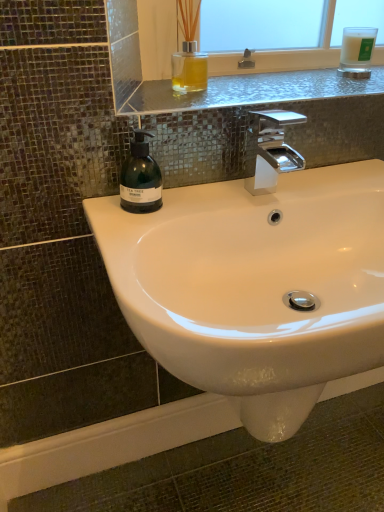
Question: Considering the relative sizes of white frosted glass candle at upper right and green matte soap dispenser at left in the image provided, is white frosted glass candle at upper right shorter than green matte soap dispenser at left?

Choices:
 (A) no
 (B) yes

Answer: (B)

Question: From a real-world perspective, is white frosted glass candle at upper right physically below green matte soap dispenser at left?

Choices:
 (A) no
 (B) yes

Answer: (A)

Question: Can you see white frosted glass candle at upper right touching green matte soap dispenser at left?

Choices:
 (A) yes
 (B) no

Answer: (B)

Question: Considering the relative sizes of white frosted glass candle at upper right and green matte soap dispenser at left in the image provided, is white frosted glass candle at upper right smaller than green matte soap dispenser at left?

Choices:
 (A) no
 (B) yes

Answer: (B)

Question: From the image's perspective, would you say white frosted glass candle at upper right is positioned over green matte soap dispenser at left?

Choices:
 (A) yes
 (B) no

Answer: (A)

Question: From their relative heights in the image, would you say polished chrome faucet at center is taller or shorter than green matte soap dispenser at left?

Choices:
 (A) short
 (B) tall

Answer: (B)

Question: Is point (283, 122) closer or farther from the camera than point (119, 194)?

Choices:
 (A) farther
 (B) closer

Answer: (A)

Question: In terms of width, does polished chrome faucet at center look wider or thinner when compared to green matte soap dispenser at left?

Choices:
 (A) thin
 (B) wide

Answer: (B)

Question: From the image's perspective, is polished chrome faucet at center positioned above or below green matte soap dispenser at left?

Choices:
 (A) below
 (B) above

Answer: (B)

Question: From a real-world perspective, relative to white frosted glass candle at upper right, is polished chrome faucet at center vertically above or below?

Choices:
 (A) below
 (B) above

Answer: (A)

Question: From the image's perspective, is polished chrome faucet at center located above or below white frosted glass candle at upper right?

Choices:
 (A) below
 (B) above

Answer: (A)

Question: In terms of size, does polished chrome faucet at center appear bigger or smaller than white frosted glass candle at upper right?

Choices:
 (A) small
 (B) big

Answer: (B)

Question: Would you say polished chrome faucet at center is to the left or to the right of white frosted glass candle at upper right in the picture?

Choices:
 (A) right
 (B) left

Answer: (B)

Question: From a real-world perspective, relative to polished chrome faucet at center, is metallic glass shelf at upper center vertically above or below?

Choices:
 (A) below
 (B) above

Answer: (B)

Question: Is metallic glass shelf at upper center bigger or smaller than polished chrome faucet at center?

Choices:
 (A) big
 (B) small

Answer: (A)